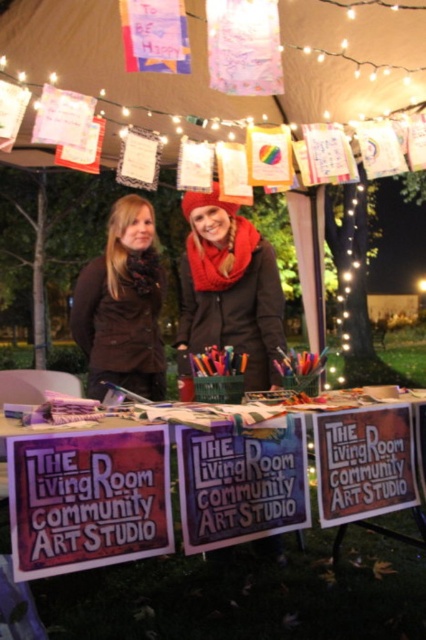
You are an attendee at the outdoor event and want to take a photo of the red scarf at center and the brown fuzzy vest at left. Which object should you focus on first if you want to capture both in one frame without moving the camera?

The red scarf at center should be focused on first because it is above the brown fuzzy vest at left, so adjusting focus to the higher position ensures both are in the frame.